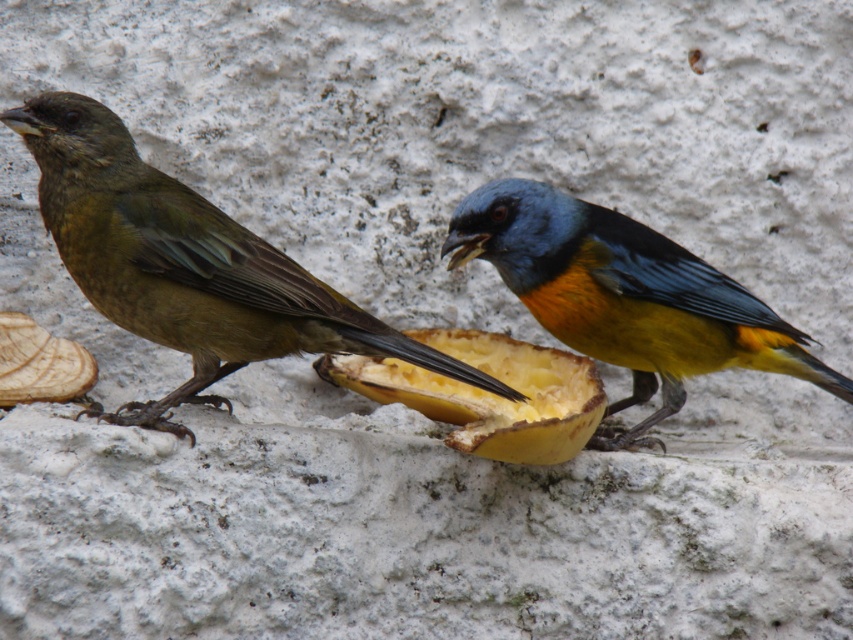
Looking at this image, does brown matte bird at left appear on the left side of blue/yellow feathers at center?

Yes, brown matte bird at left is to the left of blue/yellow feathers at center.

Is point (128, 252) closer to camera compared to point (482, 257)?

That is True.

Image resolution: width=853 pixels, height=640 pixels. In order to click on brown matte bird at left in this screenshot , I will do `click(186, 266)`.

Does brown matte bird at left come in front of yellow matte fruit at center?

No, brown matte bird at left is behind yellow matte fruit at center.

Between point (252, 278) and point (590, 369), which one is positioned in front?

Point (252, 278)

This screenshot has width=853, height=640. Identify the location of brown matte bird at left. [186, 266].

Is point (706, 326) positioned behind point (537, 387)?

No, it is not.

Who is positioned more to the left, blue/yellow feathers at center or yellow matte fruit at center?

yellow matte fruit at center

Is point (569, 340) behind point (490, 348)?

No, (569, 340) is closer to viewer.

Find the location of a particular element. Image resolution: width=853 pixels, height=640 pixels. blue/yellow feathers at center is located at coordinates (625, 298).